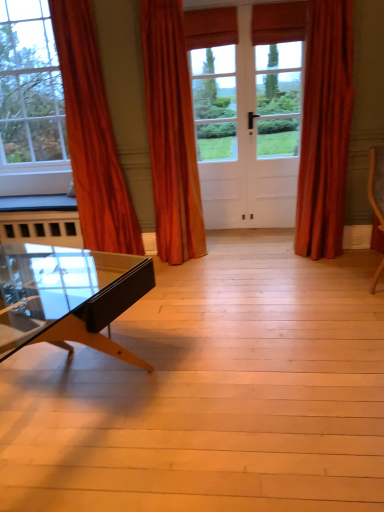
Question: Is orange velvet curtain at left, the 3th curtain when ordered from right to left, bigger than orange velvet curtain at center, the 2th curtain positioned from the right?

Choices:
 (A) no
 (B) yes

Answer: (B)

Question: Does orange velvet curtain at left, the 1th curtain when ordered from left to right, have a lesser width compared to orange velvet curtain at center, which is the 2th curtain from left to right?

Choices:
 (A) yes
 (B) no

Answer: (B)

Question: Are orange velvet curtain at left, the 3th curtain when ordered from right to left, and orange velvet curtain at center, the 2th curtain positioned from the right, beside each other?

Choices:
 (A) yes
 (B) no

Answer: (B)

Question: Is the depth of orange velvet curtain at left, the 3th curtain when ordered from right to left, less than that of orange velvet curtain at center, the 2th curtain positioned from the right?

Choices:
 (A) no
 (B) yes

Answer: (B)

Question: Can you confirm if orange velvet curtain at left, the 1th curtain when ordered from left to right, is wider than orange velvet curtain at center, the 2th curtain positioned from the right?

Choices:
 (A) no
 (B) yes

Answer: (B)

Question: From the image's perspective, is orange velvet curtain at left, the 3th curtain when ordered from right to left, above orange velvet curtain at center, which is the 2th curtain from left to right?

Choices:
 (A) yes
 (B) no

Answer: (B)

Question: Can you confirm if orange velvet curtain at left, the 1th curtain when ordered from left to right, is wider than velvet orange curtain at right, the 1th curtain in the right-to-left sequence?

Choices:
 (A) yes
 (B) no

Answer: (A)

Question: Is the position of orange velvet curtain at left, the 3th curtain when ordered from right to left, less distant than that of velvet orange curtain at right, the 1th curtain in the right-to-left sequence?

Choices:
 (A) no
 (B) yes

Answer: (B)

Question: From the image's perspective, is orange velvet curtain at left, the 1th curtain when ordered from left to right, beneath velvet orange curtain at right, the 1th curtain in the right-to-left sequence?

Choices:
 (A) yes
 (B) no

Answer: (A)

Question: Is orange velvet curtain at left, the 3th curtain when ordered from right to left, facing towards velvet orange curtain at right, which is the 3th curtain in left-to-right order?

Choices:
 (A) yes
 (B) no

Answer: (B)

Question: Is orange velvet curtain at left, the 1th curtain when ordered from left to right, shorter than velvet orange curtain at right, which is the 3th curtain in left-to-right order?

Choices:
 (A) yes
 (B) no

Answer: (B)

Question: From the image's perspective, would you say orange velvet curtain at left, the 3th curtain when ordered from right to left, is positioned over velvet orange curtain at right, the 1th curtain in the right-to-left sequence?

Choices:
 (A) yes
 (B) no

Answer: (B)

Question: Can you confirm if orange velvet curtain at center, the 2th curtain positioned from the right, is wider than orange velvet curtain at left, the 1th curtain when ordered from left to right?

Choices:
 (A) no
 (B) yes

Answer: (A)